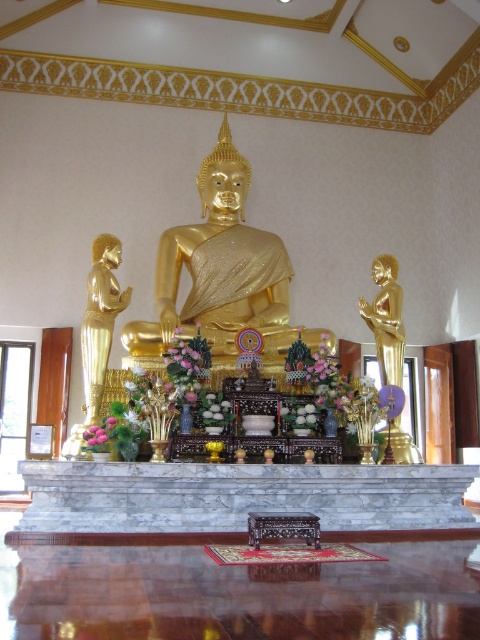
Who is lower down, gold polished statue at left or gold polished statue at right?

gold polished statue at left

Can you confirm if gold polished statue at left is smaller than gold polished statue at right?

Yes, gold polished statue at left is smaller than gold polished statue at right.

Between point (107, 237) and point (399, 310), which one is positioned behind?

Point (399, 310)

I want to click on gold polished statue at left, so [99, 317].

From the picture: Can you confirm if gold shiny statue at center is wider than gold polished statue at right?

Correct, the width of gold shiny statue at center exceeds that of gold polished statue at right.

Does gold shiny statue at center have a smaller size compared to gold polished statue at right?

Actually, gold shiny statue at center might be larger than gold polished statue at right.

Is point (213, 209) closer to viewer compared to point (394, 436)?

No, (213, 209) is behind (394, 436).

Where is `gold shiny statue at center`? This screenshot has width=480, height=640. gold shiny statue at center is located at coordinates (222, 273).

How far apart are gold shiny statue at center and gold polished statue at left?

gold shiny statue at center and gold polished statue at left are 8.41 meters apart from each other.

Is point (222, 125) positioned before point (97, 269)?

No, (222, 125) is further to viewer.

Where is `gold shiny statue at center`? gold shiny statue at center is located at coordinates (222, 273).